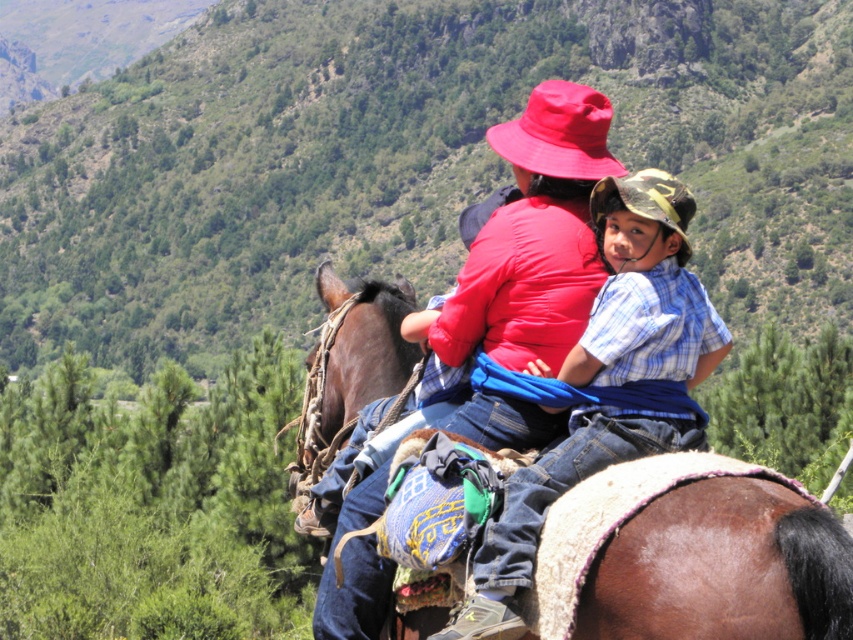
Question: Which point is closer to the camera taking this photo?

Choices:
 (A) (701, 442)
 (B) (621, 205)

Answer: (A)

Question: Estimate the real-world distances between objects in this image. Which object is farther from the camouflage fabric cowboy hat at upper center?

Choices:
 (A) brown leather saddle at center
 (B) blue plaid shirt at center
 (C) green leafy hillside at upper center
 (D) red fabric cowboy hat at upper center

Answer: (C)

Question: Which object is farther from the camera taking this photo?

Choices:
 (A) green leafy hillside at upper center
 (B) camouflage fabric cowboy hat at upper center
 (C) blue plaid shirt at center

Answer: (A)

Question: Does green leafy hillside at upper center appear over brown leather saddle at center?

Choices:
 (A) no
 (B) yes

Answer: (B)

Question: Is the position of blue plaid shirt at center less distant than that of brown leather saddle at center?

Choices:
 (A) yes
 (B) no

Answer: (B)

Question: Can you confirm if blue plaid shirt at center is positioned above red fabric cowboy hat at upper center?

Choices:
 (A) yes
 (B) no

Answer: (B)